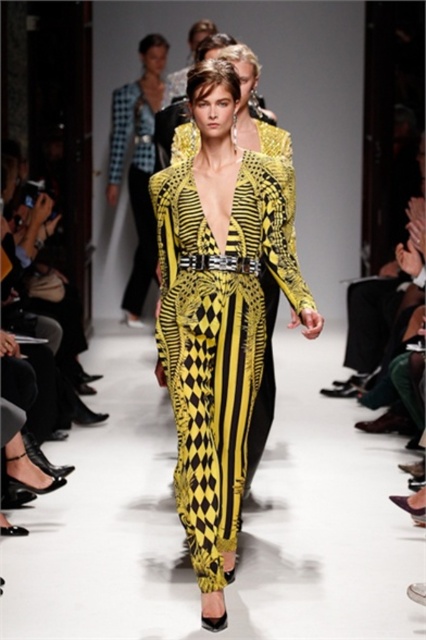
Question: Is yellow printed dress at center to the right of yellow printed jumpsuit at center from the viewer's perspective?

Choices:
 (A) no
 (B) yes

Answer: (B)

Question: Observing the image, what is the correct spatial positioning of yellow printed dress at center in reference to yellow printed jumpsuit at center?

Choices:
 (A) below
 (B) above

Answer: (A)

Question: Which of the following is the farthest from the observer?

Choices:
 (A) yellow printed jumpsuit at center
 (B) yellow printed dress at center

Answer: (A)

Question: Is yellow printed dress at center further to the viewer compared to yellow printed jumpsuit at center?

Choices:
 (A) yes
 (B) no

Answer: (B)

Question: Which point is farther to the camera?

Choices:
 (A) yellow printed jumpsuit at center
 (B) yellow printed dress at center

Answer: (A)